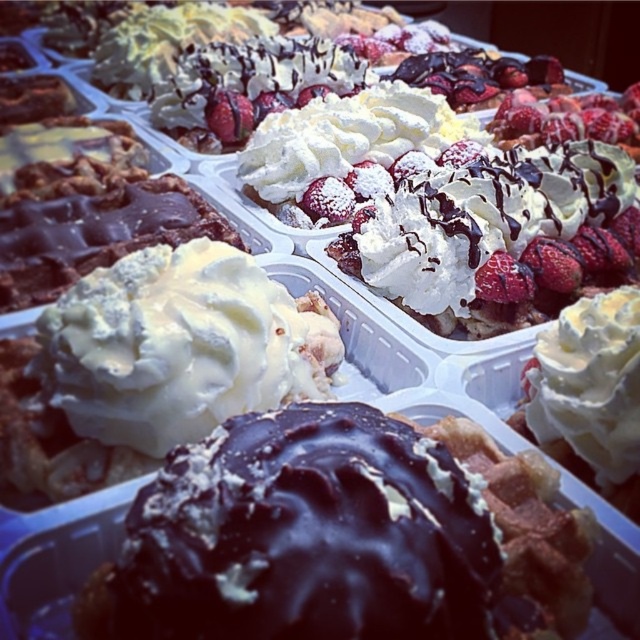
In the scene shown: You are a customer looking at the desserts arranged in containers. You see two points marked on the image. The first point is at position point (118, 312) and the second is at point (513, 209). Which of these two points is closer to you?

Point (118, 312) is in front of point (513, 209), so the first point is closer to you.

You are a dessert delivery person who needs to place two items into a box. The box has a divider that can only hold items if they are at least 18 inches apart. You have the whipped cream at center and the whipped cream topped waffle with strawberries at center. Can you safely place them in the same section of the box?

The whipped cream at center is 17.49 inches from whipped cream topped waffle with strawberries at center. Since the required distance is 18 inches and the actual distance is less than that, they cannot be placed in the same section of the box safely.